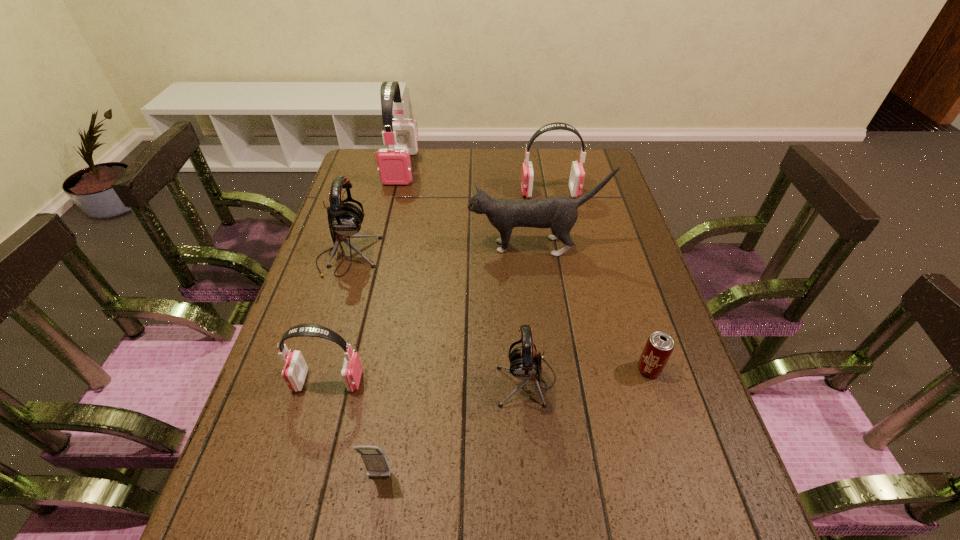
Find the location of `vacant space located 0.170m on the outer surface of the smallest pink earphone`. vacant space located 0.170m on the outer surface of the smallest pink earphone is located at coordinates (439, 381).

The width and height of the screenshot is (960, 540). What are the coordinates of `vacant space situated on the front-facing side of the fifth object from right to left` in the screenshot? It's located at (370, 536).

Locate an element on the screen. free space located on the left of the shortest object is located at coordinates (597, 369).

You are a GUI agent. You are given a task and a screenshot of the screen. Output one action in this format:
    pyautogui.click(x=<x>, y=<y>)
    Task: Click on the object that is at the far edge
    This screenshot has width=960, height=540.
    Given the screenshot: What is the action you would take?
    pyautogui.click(x=394, y=165)

Find the location of a particular element. cat that is at the right edge is located at coordinates (559, 213).

What are the coordinates of `earphone located at the right edge` in the screenshot? It's located at (577, 174).

Locate an element on the screen. The height and width of the screenshot is (540, 960). beer can situated at the right edge is located at coordinates (659, 346).

Where is `object present at the far left corner`? object present at the far left corner is located at coordinates (394, 165).

In the image, there is a desktop. Where is `vacant space at the far edge`? vacant space at the far edge is located at coordinates (543, 152).

The width and height of the screenshot is (960, 540). Identify the location of vacant space at the near edge. (634, 534).